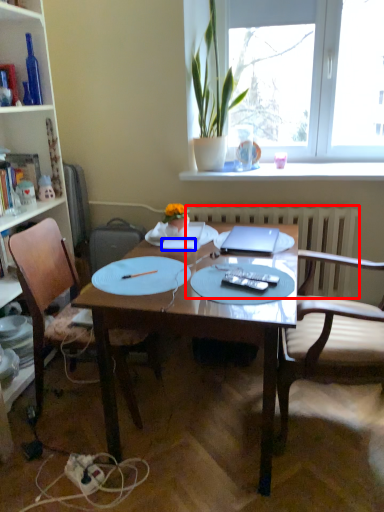
Question: Which point is closer to the camera, radiator (highlighted by a red box) or notebook (highlighted by a blue box)?

Choices:
 (A) radiator
 (B) notebook

Answer: (B)